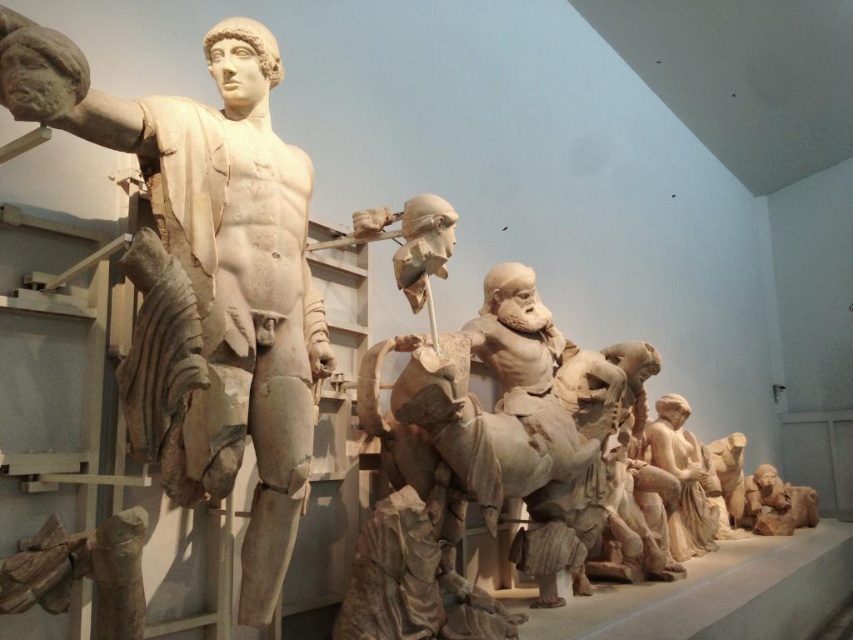
Question: Can you confirm if white marble statue at left is positioned above smooth beige statue at lower right?

Choices:
 (A) yes
 (B) no

Answer: (A)

Question: Which object is farther from the camera taking this photo?

Choices:
 (A) smooth beige statue at lower right
 (B) white marble statue at left

Answer: (A)

Question: Does white marble statue at left have a greater width compared to smooth beige statue at lower right?

Choices:
 (A) no
 (B) yes

Answer: (B)

Question: Which of the following is the farthest from the observer?

Choices:
 (A) (689, 496)
 (B) (114, 124)

Answer: (A)

Question: Is white marble statue at left thinner than smooth beige statue at lower right?

Choices:
 (A) no
 (B) yes

Answer: (A)